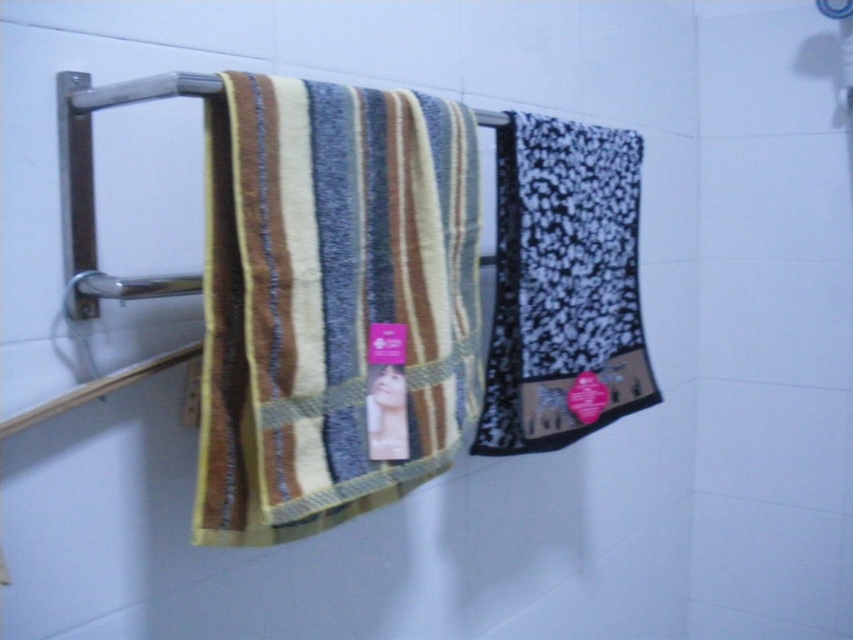
You are standing in a bathroom and notice two towels hanging on a metal rack. You want to grab the towel that is closer to you. Which one should you choose between the multicolored woven towel at center and the black textured towel at right?

The multicolored woven towel at center is closer to the viewer, so you should choose the multicolored woven towel at center.

Based on the photo, you are trying to hang a new towel on the rack between the multicolored woven towel at center and the black textured towel at right. Which side should you place it on to maintain the current height arrangement?

Since the multicolored woven towel at center is not as tall as the black textured towel at right, you should place the new towel on the right side of the multicolored woven towel at center to keep it shorter than the black textured towel at right.